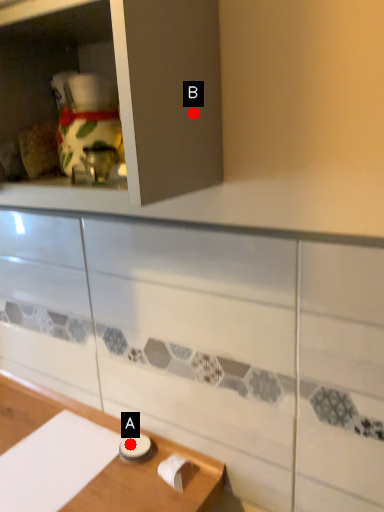
Question: Two points are circled on the image, labeled by A and B beside each circle. Which point appears closest to the camera in this image?

Choices:
 (A) A is closer
 (B) B is closer

Answer: (B)